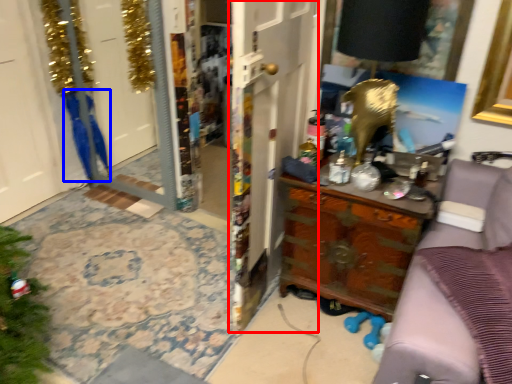
Question: Which of the following is the farthest to the observer, door (highlighted by a red box) or robe (highlighted by a blue box)?

Choices:
 (A) door
 (B) robe

Answer: (B)